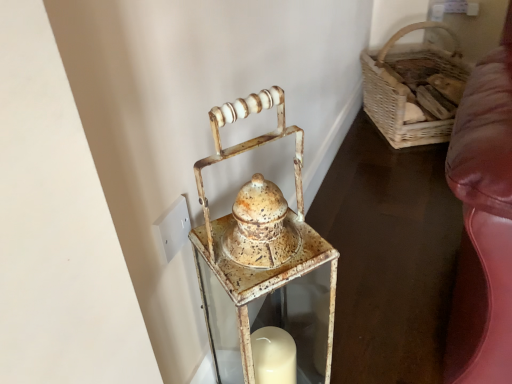
Question: Is rusty metal lantern at center far away from woven wood basket at right?

Choices:
 (A) yes
 (B) no

Answer: (A)

Question: Is rusty metal lantern at center at the left side of woven wood basket at right?

Choices:
 (A) no
 (B) yes

Answer: (B)

Question: Is rusty metal lantern at center wider than woven wood basket at right?

Choices:
 (A) no
 (B) yes

Answer: (A)

Question: Does rusty metal lantern at center contain woven wood basket at right?

Choices:
 (A) no
 (B) yes

Answer: (A)

Question: Considering the relative sizes of rusty metal lantern at center and woven wood basket at right in the image provided, is rusty metal lantern at center bigger than woven wood basket at right?

Choices:
 (A) yes
 (B) no

Answer: (B)

Question: From a real-world perspective, is rusty metal lantern at center positioned under woven wood basket at right based on gravity?

Choices:
 (A) yes
 (B) no

Answer: (B)

Question: From the image's perspective, is woven wood basket at right under rusty metal lantern at center?

Choices:
 (A) yes
 (B) no

Answer: (B)

Question: Could you tell me if woven wood basket at right is facing rusty metal lantern at center?

Choices:
 (A) yes
 (B) no

Answer: (B)

Question: Does woven wood basket at right have a smaller size compared to rusty metal lantern at center?

Choices:
 (A) yes
 (B) no

Answer: (B)

Question: Are woven wood basket at right and rusty metal lantern at center far apart?

Choices:
 (A) yes
 (B) no

Answer: (A)

Question: Considering the relative positions of woven wood basket at right and rusty metal lantern at center in the image provided, is woven wood basket at right behind rusty metal lantern at center?

Choices:
 (A) yes
 (B) no

Answer: (A)

Question: Is woven wood basket at right bigger than rusty metal lantern at center?

Choices:
 (A) no
 (B) yes

Answer: (B)

Question: Is point (x=307, y=241) closer or farther from the camera than point (x=407, y=140)?

Choices:
 (A) closer
 (B) farther

Answer: (A)